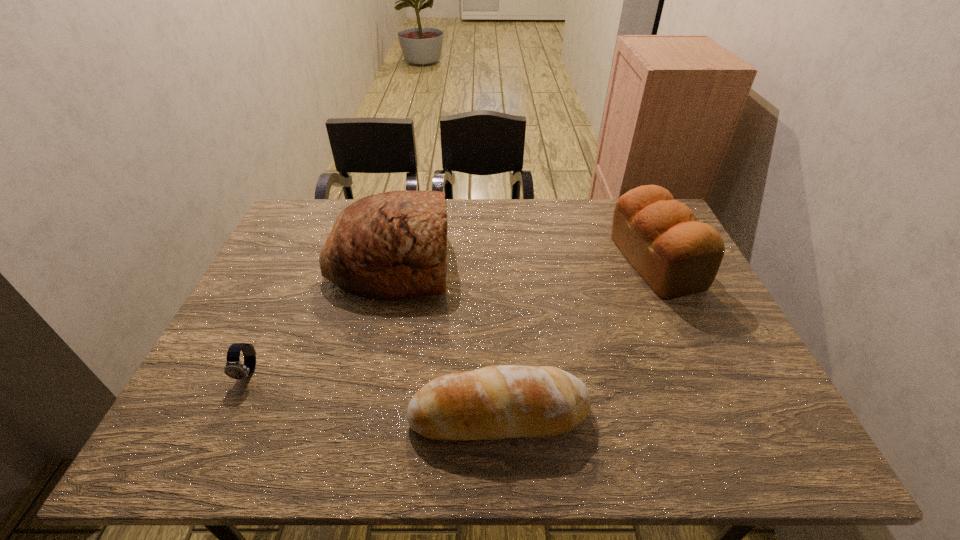
At what (x,y) coordinates should I click in order to perform the action: click on object that is at the right edge. Please return your answer as a coordinate pair (x, y). Image resolution: width=960 pixels, height=540 pixels. Looking at the image, I should click on (677, 256).

At what (x,y) coordinates should I click in order to perform the action: click on object located in the far right corner section of the desktop. Please return your answer as a coordinate pair (x, y). Image resolution: width=960 pixels, height=540 pixels. Looking at the image, I should click on (677, 256).

I want to click on vacant area at the far edge of the desktop, so click(569, 233).

Locate an element on the screen. blank space at the near edge of the desktop is located at coordinates [x=710, y=442].

This screenshot has width=960, height=540. Identify the location of vacant space at the left edge. (293, 326).

In the image, there is a desktop. At what (x,y) coordinates should I click in order to perform the action: click on blank space at the right edge. Please return your answer as a coordinate pair (x, y). Looking at the image, I should click on (742, 389).

In the image, there is a desktop. At what (x,y) coordinates should I click in order to perform the action: click on free space at the near left corner. Please return your answer as a coordinate pair (x, y). This screenshot has width=960, height=540. Looking at the image, I should click on (228, 453).

You are a GUI agent. You are given a task and a screenshot of the screen. Output one action in this format:
    pyautogui.click(x=<x>, y=<y>)
    Task: Click on the unoccupied area between the leftmost object and the rightmost object
    Image resolution: width=960 pixels, height=540 pixels.
    Given the screenshot: What is the action you would take?
    pyautogui.click(x=452, y=317)

Identify the location of vacant region between the rightmost object and the watch. (452, 317).

Find the location of `vacant space that is in between the shortest bread and the rightmost object`. vacant space that is in between the shortest bread and the rightmost object is located at coordinates (577, 338).